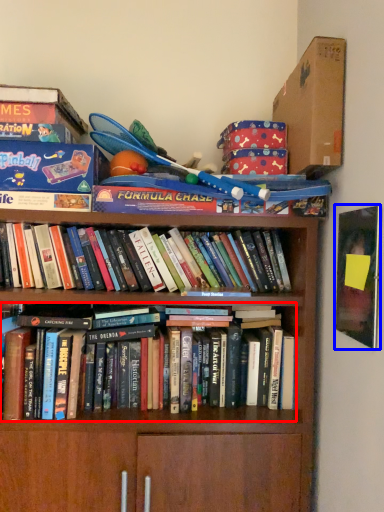
Question: Among these objects, which one is nearest to the camera, book (highlighted by a red box) or paperback book (highlighted by a blue box)?

Choices:
 (A) book
 (B) paperback book

Answer: (B)